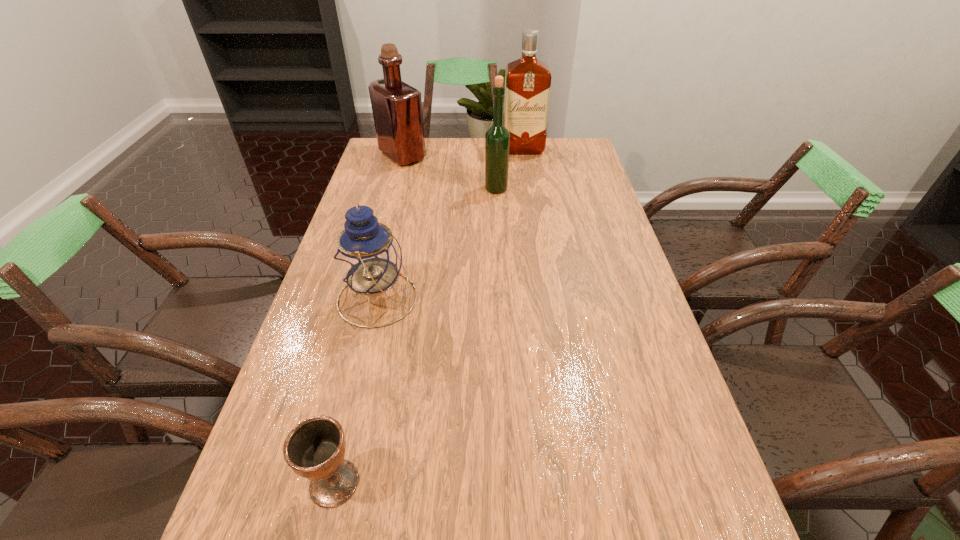
Identify the location of the leftmost liquor. Image resolution: width=960 pixels, height=540 pixels. (397, 107).

Find the location of a particular element. This screenshot has height=540, width=960. the nearest liquor is located at coordinates (497, 138).

I want to click on the second nearest object, so click(x=368, y=258).

Find the location of a particular element. This screenshot has width=960, height=540. lantern is located at coordinates (368, 258).

The image size is (960, 540). Find the location of `the shortest object`. the shortest object is located at coordinates tap(315, 448).

At what (x,y) coordinates should I click in order to perform the action: click on the nearest object. Please return your answer as a coordinate pair (x, y). The height and width of the screenshot is (540, 960). Looking at the image, I should click on (315, 448).

Find the location of a particular element. The image size is (960, 540). free space located on the front of the leftmost liquor is located at coordinates click(x=386, y=218).

Identify the location of blank area located on the front of the nearest liquor. The width and height of the screenshot is (960, 540). (500, 268).

Locate an element on the screen. This screenshot has width=960, height=540. vacant position located on the front-facing side of the lantern is located at coordinates (493, 298).

Where is `free space located on the left of the shortest object`? The height and width of the screenshot is (540, 960). free space located on the left of the shortest object is located at coordinates (246, 483).